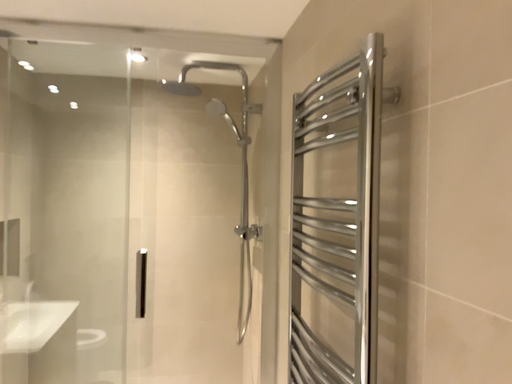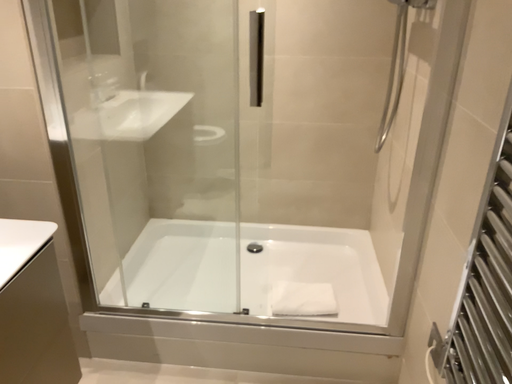
Question: Which way did the camera rotate in the video?

Choices:
 (A) rotated right
 (B) rotated left

Answer: (B)